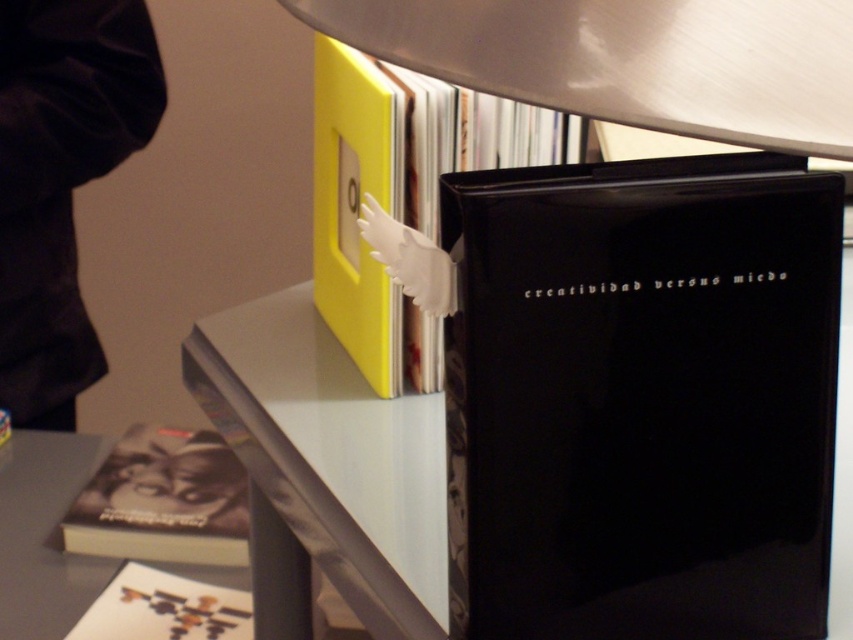
You are organizing a small exhibition and need to decide which item to place in a limited space. Given the black glossy book at center and the black velvet jacket at upper left, which item would require less space?

The black glossy book at center occupies less space than the black velvet jacket at upper left, so it would require less space.

You are an interior designer who wants to place a new object on the bookshelf. The bookshelf has a coordinate system where the bottom left corner is at point 0,0 and the top right corner is at 1,1. You want to place the new object so that it does not overlap with the black matte book at lower left. What is the minimum x coordinate you can use for the new object?

The black matte book at lower left is located at point (163, 500). To avoid overlapping, the new object should be placed with an x coordinate greater than 0.783.